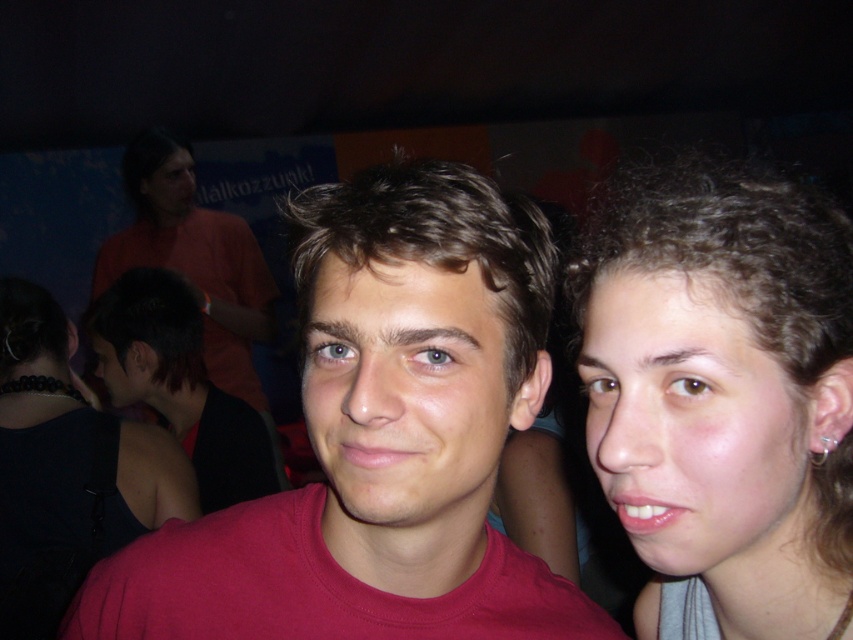
Question: Can you confirm if smooth skin face at right is wider than matte black hair at lower left?

Choices:
 (A) no
 (B) yes

Answer: (A)

Question: Considering the relative positions of matte red t-shirt at center and matte black hair at lower left in the image provided, where is matte red t-shirt at center located with respect to matte black hair at lower left?

Choices:
 (A) below
 (B) above

Answer: (A)

Question: Considering the real-world distances, which object is closest to the matte black hair at lower left?

Choices:
 (A) matte black face at upper left
 (B) matte red t-shirt at center
 (C) smooth skin face at right

Answer: (A)

Question: Which point is closer to the camera?

Choices:
 (A) (372, 525)
 (B) (160, 193)
 (C) (93, 344)

Answer: (A)

Question: Which point is closer to the camera?

Choices:
 (A) black leather dress at lower left
 (B) matte red t-shirt at center

Answer: (B)

Question: From the image, what is the correct spatial relationship of matte red t-shirt at center in relation to matte red shirt at center?

Choices:
 (A) left
 (B) right

Answer: (A)